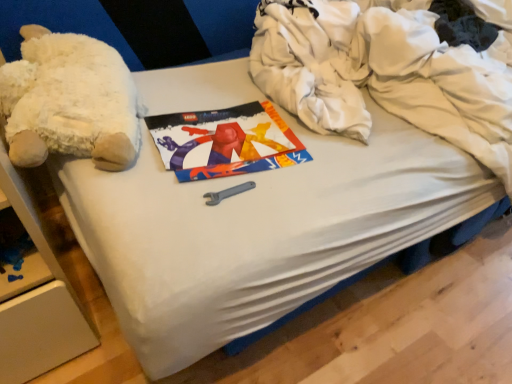
Question: Is white cotton clothing at upper right not close to white plush at left?

Choices:
 (A) yes
 (B) no

Answer: (B)

Question: Can you confirm if white cotton clothing at upper right is taller than white plush at left?

Choices:
 (A) yes
 (B) no

Answer: (A)

Question: Is white cotton clothing at upper right looking in the opposite direction of white plush at left?

Choices:
 (A) no
 (B) yes

Answer: (A)

Question: From a real-world perspective, is white cotton clothing at upper right below white plush at left?

Choices:
 (A) yes
 (B) no

Answer: (A)

Question: From the image's perspective, does white cotton clothing at upper right appear lower than white plush at left?

Choices:
 (A) no
 (B) yes

Answer: (A)

Question: Is white cotton clothing at upper right wider than white plush at left?

Choices:
 (A) yes
 (B) no

Answer: (A)

Question: Is white plush at left far away from white cotton clothing at upper right?

Choices:
 (A) yes
 (B) no

Answer: (B)

Question: Can you confirm if white plush at left is bigger than white cotton clothing at upper right?

Choices:
 (A) yes
 (B) no

Answer: (B)

Question: Is white plush at left wider than white cotton clothing at upper right?

Choices:
 (A) no
 (B) yes

Answer: (A)

Question: Is white plush at left further to camera compared to white cotton clothing at upper right?

Choices:
 (A) yes
 (B) no

Answer: (A)

Question: Is white plush at left looking in the opposite direction of white cotton clothing at upper right?

Choices:
 (A) no
 (B) yes

Answer: (A)

Question: Does white plush at left have a smaller size compared to white cotton clothing at upper right?

Choices:
 (A) no
 (B) yes

Answer: (B)

Question: From the image's perspective, is white cotton clothing at upper right positioned above or below white plush at left?

Choices:
 (A) below
 (B) above

Answer: (B)